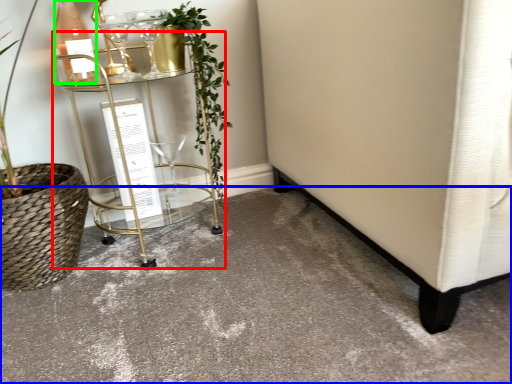
Question: Which object is positioned closest to table (highlighted by a red box)? Select from concrete (highlighted by a blue box) and bottle (highlighted by a green box).

Choices:
 (A) concrete
 (B) bottle

Answer: (B)